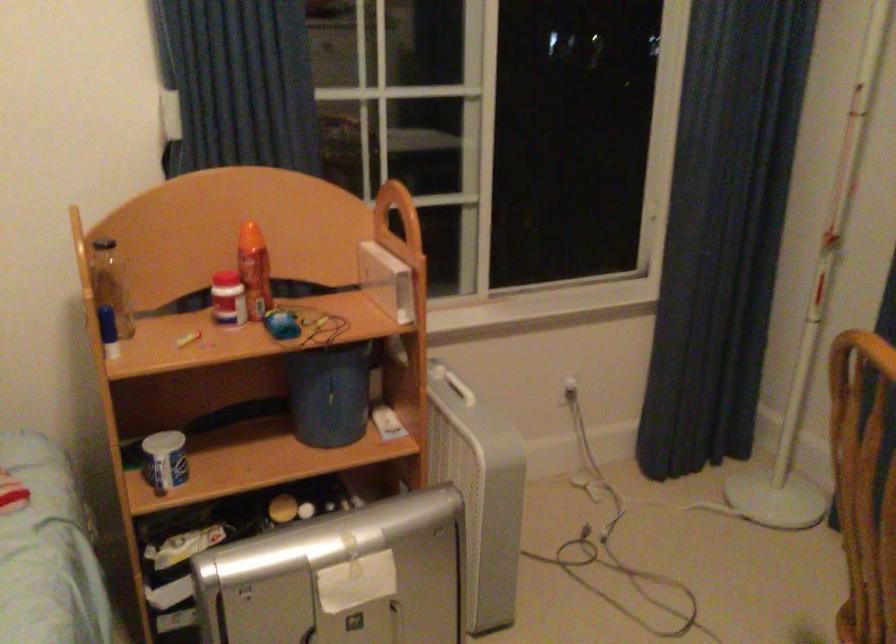
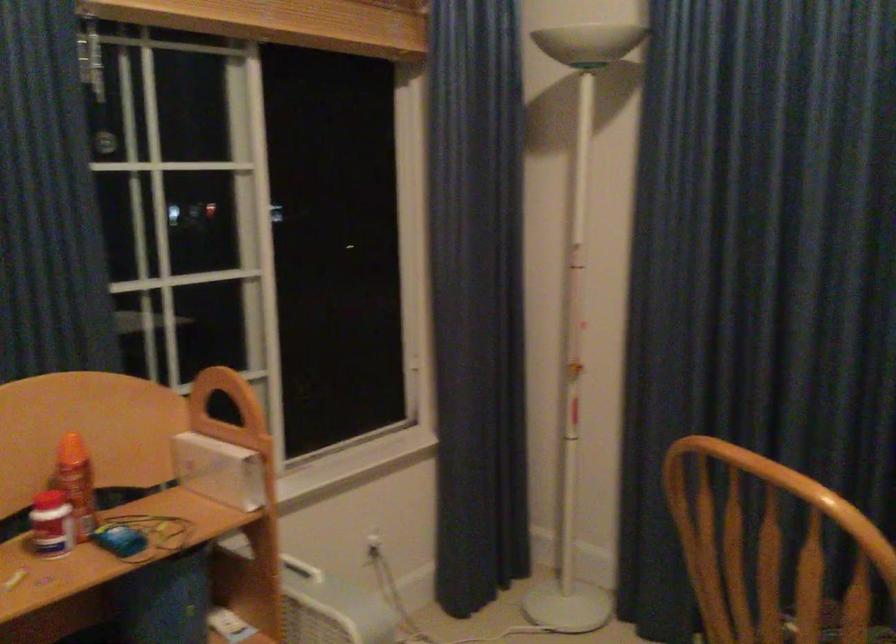
Question: The camera is either moving clockwise (left) or counter-clockwise (right) around the object. The first image is from the beginning of the video and the second image is from the end. Is the camera moving left or right when shooting the video?

Choices:
 (A) Left
 (B) Right

Answer: (A)